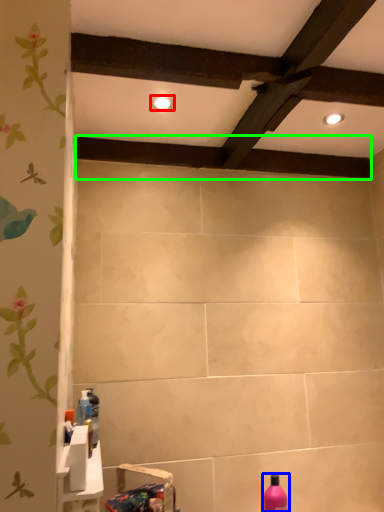
Question: Estimate the real-world distances between objects in this image. Which object is farther from lighting (highlighted by a red box), bottle (highlighted by a blue box) or plank (highlighted by a green box)?

Choices:
 (A) bottle
 (B) plank

Answer: (A)